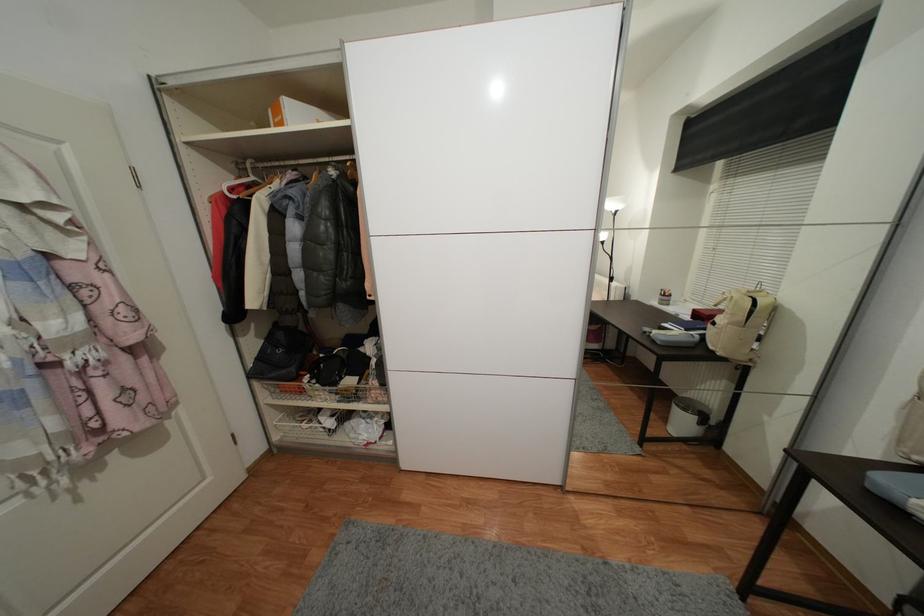
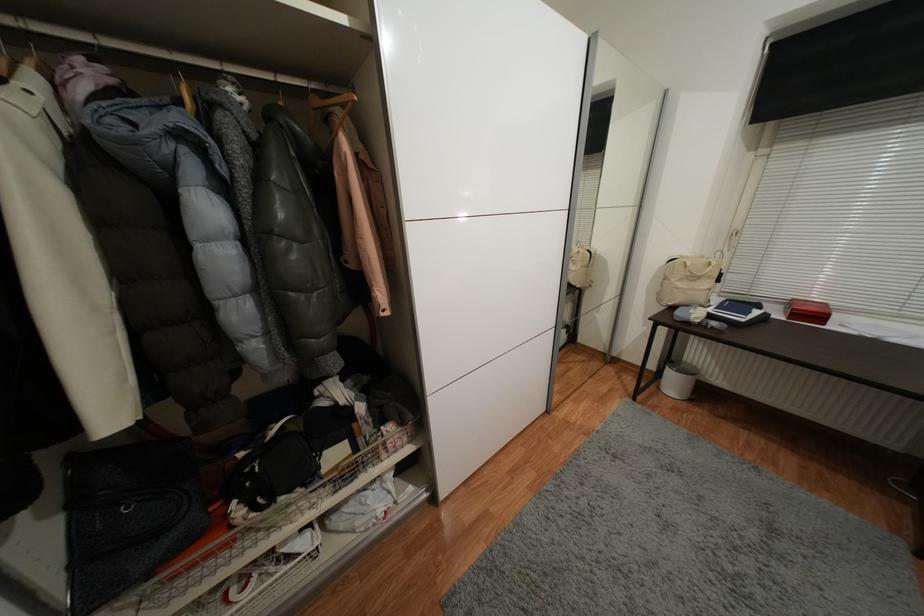
Where in the second image is the point corresponding to (344,403) from the first image?

(342, 493)